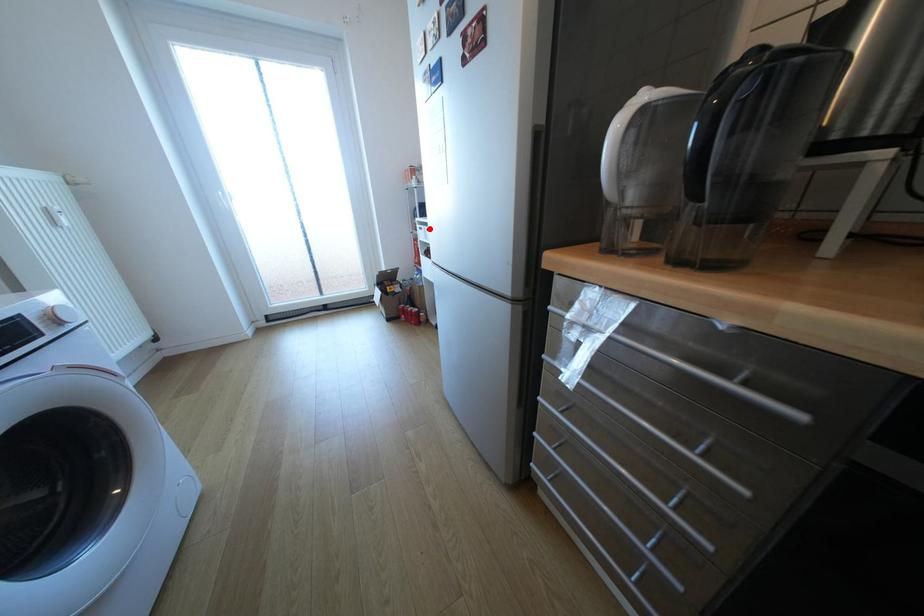
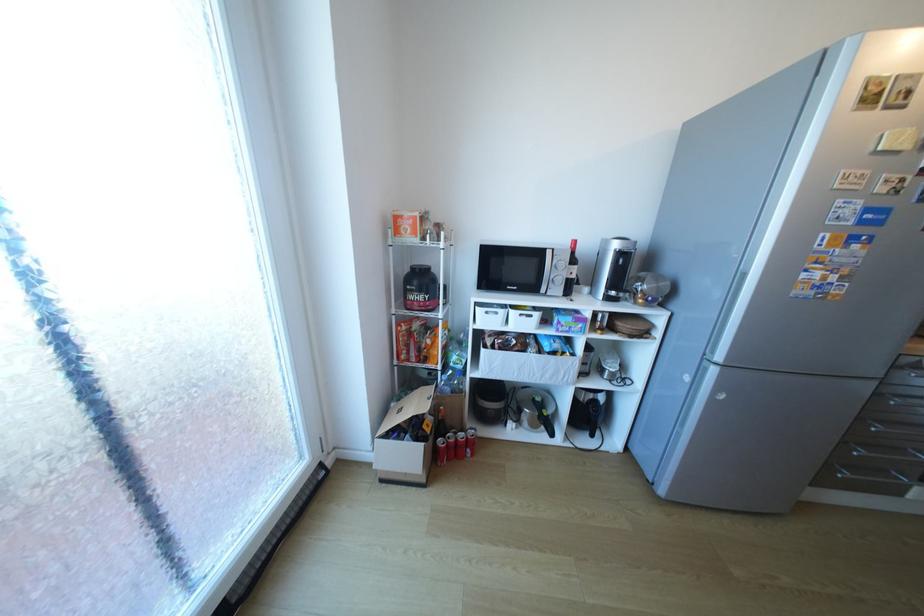
Question: I am providing you with two images of the same scene from different viewpoints. A red point is marked on the first image. Is the red point's position out of view in image 2?

Choices:
 (A) Yes
 (B) No

Answer: (B)